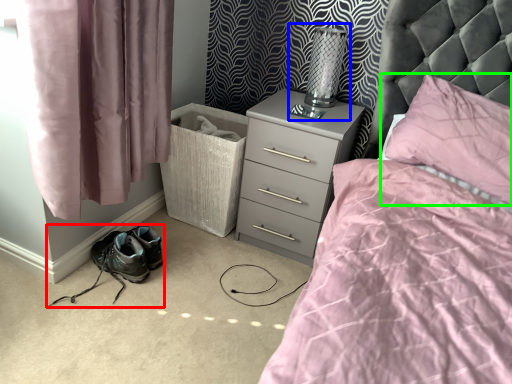
Question: Which object is positioned closest to footwear (highlighted by a red box)? Select from table lamp (highlighted by a blue box) and pillow (highlighted by a green box).

Choices:
 (A) table lamp
 (B) pillow

Answer: (A)